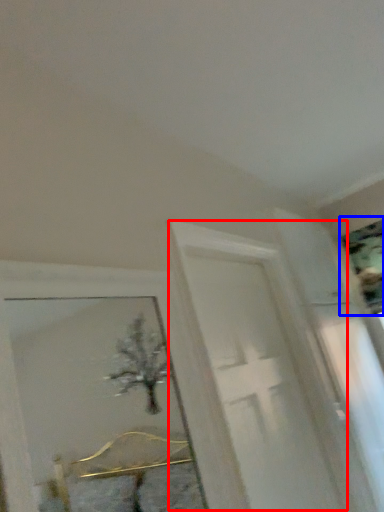
Question: Which point is further to the camera, screen door (highlighted by a red box) or picture frame (highlighted by a blue box)?

Choices:
 (A) screen door
 (B) picture frame

Answer: (B)